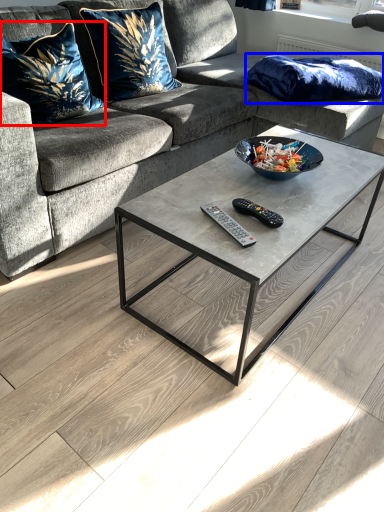
Question: Among these objects, which one is farthest to the camera, pillow (highlighted by a red box) or pillow (highlighted by a blue box)?

Choices:
 (A) pillow
 (B) pillow

Answer: (B)